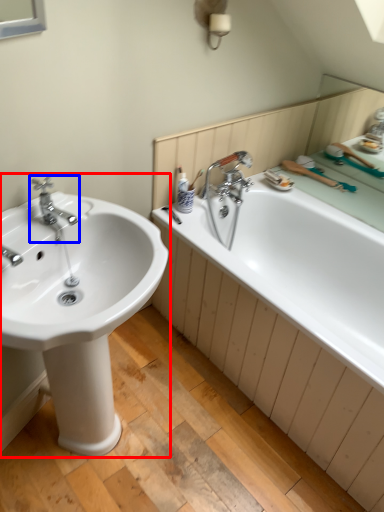
Question: Which point is further to the camera, sink (highlighted by a red box) or tap (highlighted by a blue box)?

Choices:
 (A) sink
 (B) tap

Answer: (B)